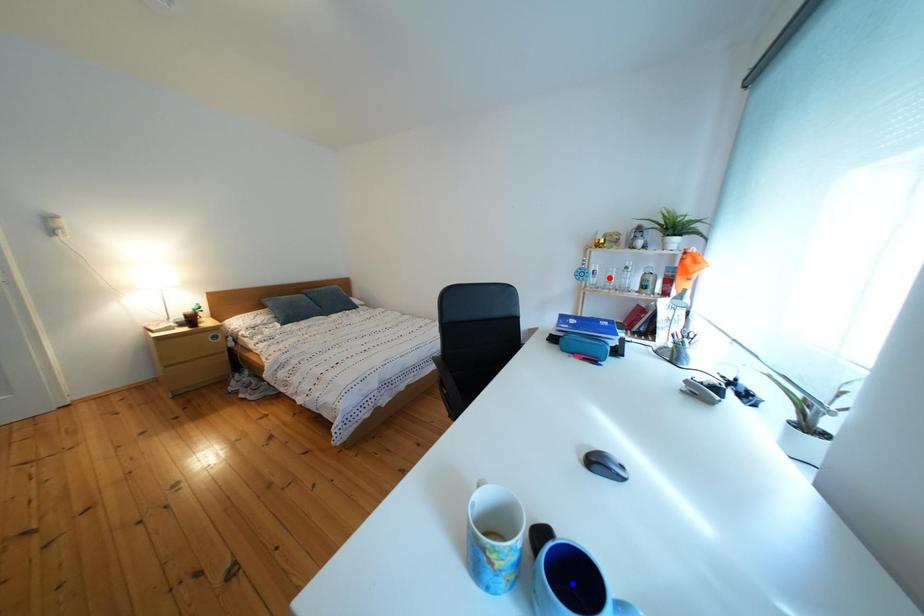
Question: In the image, two points are highlighted. Which point is nearer to the camera? Reply with the corresponding letter.

Choices:
 (A) blue point
 (B) red point

Answer: (A)